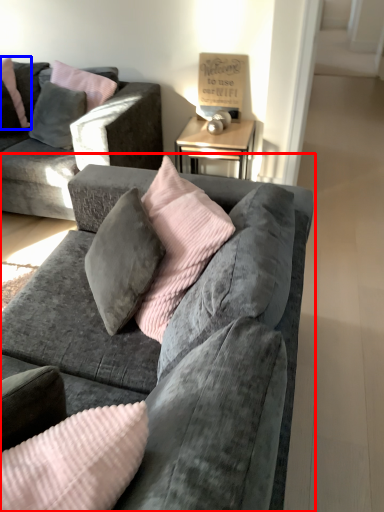
Question: Which of the following is the farthest to the observer, studio couch (highlighted by a red box) or pillow (highlighted by a blue box)?

Choices:
 (A) studio couch
 (B) pillow

Answer: (B)